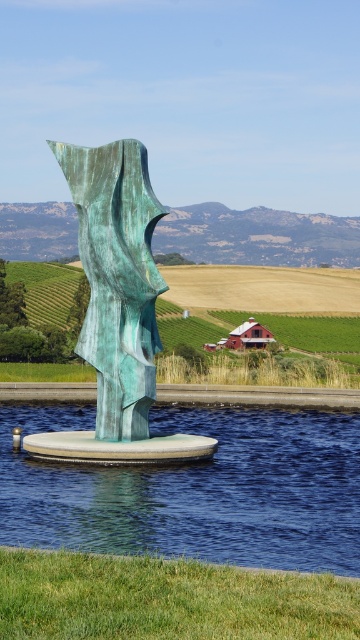
Question: Can you confirm if green patina sculpture at center is positioned below green grassy field at center?

Choices:
 (A) yes
 (B) no

Answer: (B)

Question: Which point is closer to the camera?

Choices:
 (A) (261, 371)
 (B) (150, 308)

Answer: (B)

Question: Does clear blue water at center appear over green grassy field at center?

Choices:
 (A) yes
 (B) no

Answer: (B)

Question: Which object is closer to the camera taking this photo?

Choices:
 (A) clear blue water at center
 (B) green grassy field at center
 (C) green patina sculpture at center

Answer: (A)

Question: Does green patina sculpture at center have a smaller size compared to green grassy field at center?

Choices:
 (A) no
 (B) yes

Answer: (B)

Question: Which point is closer to the camera?

Choices:
 (A) green patina sculpture at center
 (B) green grassy field at center

Answer: (A)